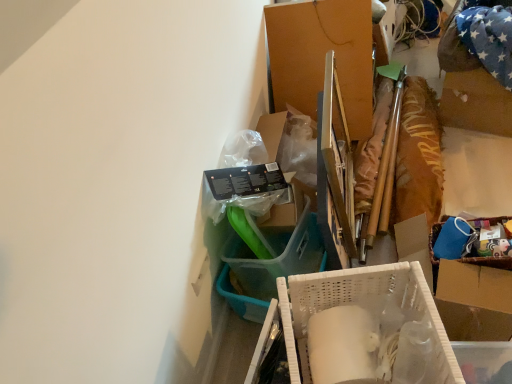
Question: Considering the relative positions of cardboard box at center, acting as the 1th box starting from the back, and white plastic basket at center, which appears as the 1th box when ordered from the bottom, in the image provided, is cardboard box at center, acting as the 1th box starting from the back, to the right of white plastic basket at center, which appears as the 1th box when ordered from the bottom, from the viewer's perspective?

Choices:
 (A) yes
 (B) no

Answer: (A)

Question: Are cardboard box at center, acting as the 2th box starting from the front, and white plastic basket at center, the second box positioned from the back, making contact?

Choices:
 (A) yes
 (B) no

Answer: (B)

Question: Is white plastic basket at center, which appears as the 1th box when ordered from the bottom, at the back of cardboard box at center, positioned as the 1th box in top-to-bottom order?

Choices:
 (A) yes
 (B) no

Answer: (B)

Question: Does cardboard box at center, acting as the 1th box starting from the back, have a smaller size compared to white plastic basket at center, marked as the first box in a front-to-back arrangement?

Choices:
 (A) no
 (B) yes

Answer: (B)

Question: From a real-world perspective, is cardboard box at center, acting as the second box starting from the bottom, below white plastic basket at center, marked as the first box in a front-to-back arrangement?

Choices:
 (A) no
 (B) yes

Answer: (B)

Question: From the image's perspective, is cardboard box at center, acting as the 1th box starting from the back, located above white plastic basket at center, placed as the 2th box when sorted from top to bottom?

Choices:
 (A) yes
 (B) no

Answer: (A)

Question: Is cardboard box at center, acting as the 2th box starting from the front, turned away from white plastic basket at center?

Choices:
 (A) no
 (B) yes

Answer: (A)

Question: From a real-world perspective, does cardboard box at center, acting as the 1th box starting from the back, sit lower than white plastic basket at center?

Choices:
 (A) no
 (B) yes

Answer: (B)

Question: From a real-world perspective, does cardboard box at center, acting as the second box starting from the bottom, stand above white plastic basket at center?

Choices:
 (A) yes
 (B) no

Answer: (B)

Question: From the image's perspective, would you say cardboard box at center, acting as the 2th box starting from the front, is positioned over white plastic basket at center?

Choices:
 (A) no
 (B) yes

Answer: (B)

Question: Considering the relative positions of cardboard box at center, acting as the second box starting from the bottom, and white plastic basket at center in the image provided, is cardboard box at center, acting as the second box starting from the bottom, behind white plastic basket at center?

Choices:
 (A) no
 (B) yes

Answer: (B)

Question: Is the depth of cardboard box at center, acting as the 2th box starting from the front, less than that of white plastic basket at center?

Choices:
 (A) no
 (B) yes

Answer: (A)

Question: Is white plastic basket at center, the second box positioned from the back, to the right of white plastic basket at center from the viewer's perspective?

Choices:
 (A) no
 (B) yes

Answer: (A)